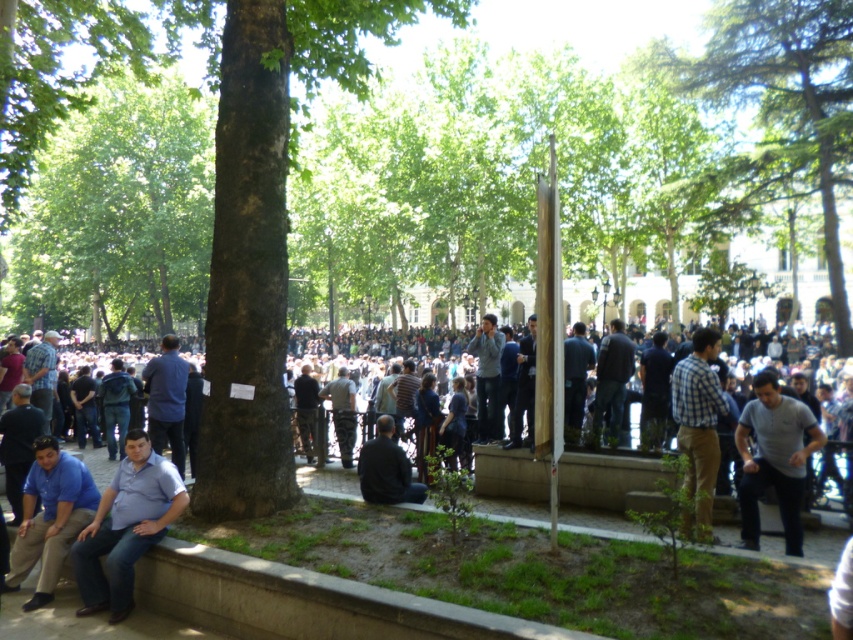
Which of these two, green leafy tree at center or light blue shirt at center, stands shorter?

Standing shorter between the two is light blue shirt at center.

Can you confirm if green leafy tree at center is taller than light blue shirt at center?

Correct, green leafy tree at center is much taller as light blue shirt at center.

Locate an element on the screen. This screenshot has height=640, width=853. green leafy tree at center is located at coordinates (119, 212).

The image size is (853, 640). What are the coordinates of `green leafy tree at center` in the screenshot? It's located at (119, 212).

Is point (683, 406) in front of point (335, 410)?

Yes, point (683, 406) is in front of point (335, 410).

Can you confirm if checkered fabric shirt at center is shorter than camouflage pants at center?

Incorrect, checkered fabric shirt at center's height does not fall short of camouflage pants at center's.

This screenshot has width=853, height=640. What do you see at coordinates (699, 422) in the screenshot? I see `checkered fabric shirt at center` at bounding box center [699, 422].

Where is `checkered fabric shirt at center`? checkered fabric shirt at center is located at coordinates (699, 422).

Is gray cotton shirt at lower right to the right of blue cotton shirt at lower left from the viewer's perspective?

Correct, you'll find gray cotton shirt at lower right to the right of blue cotton shirt at lower left.

Which is behind, point (752, 529) or point (64, 518)?

Point (752, 529)

Identify the location of gray cotton shirt at lower right. This screenshot has width=853, height=640. (775, 458).